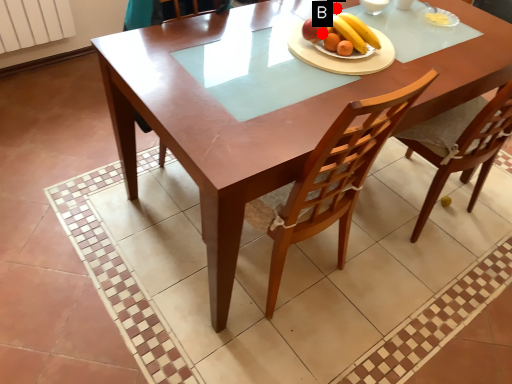
Question: Two points are circled on the image, labeled by A and B beside each circle. Which point is further to the camera?

Choices:
 (A) A is further
 (B) B is further

Answer: (A)